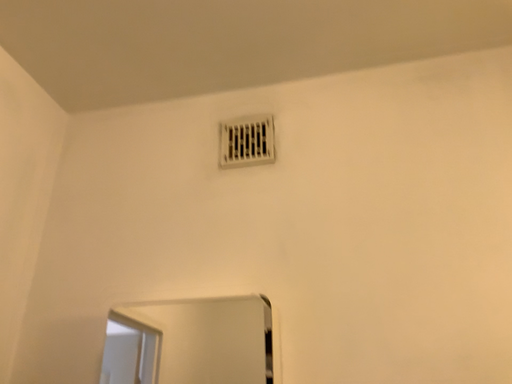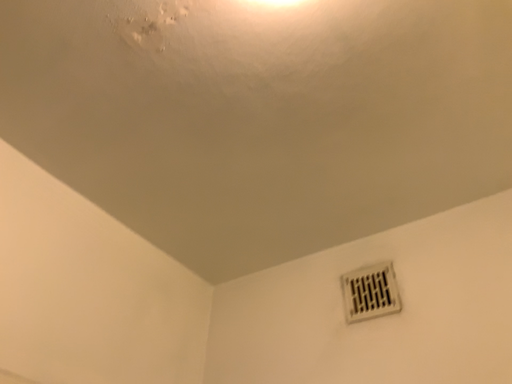
Question: Which way did the camera rotate in the video?

Choices:
 (A) rotated downward
 (B) rotated upward

Answer: (B)